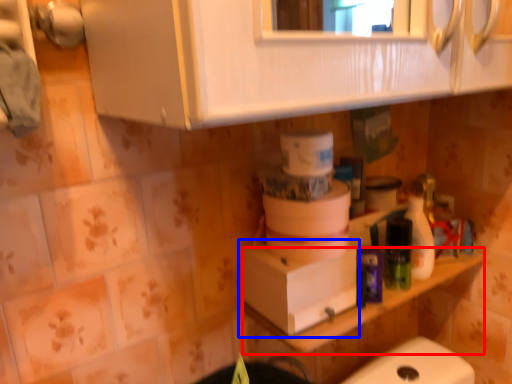
Question: Among these objects, which one is nearest to the camera, counter top (highlighted by a red box) or cardboard box (highlighted by a blue box)?

Choices:
 (A) counter top
 (B) cardboard box

Answer: (B)